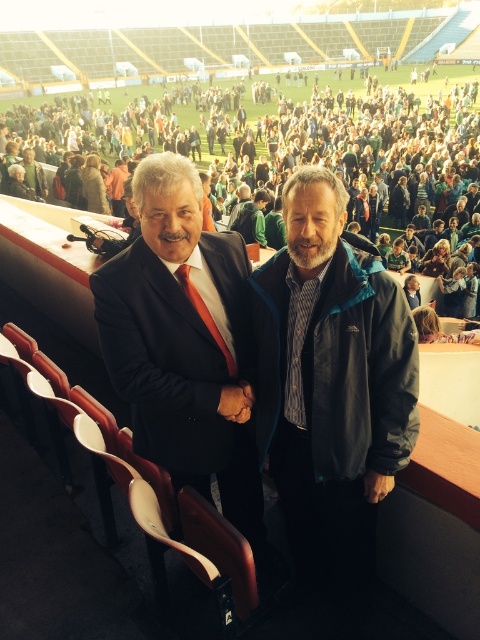
Question: Which object is closer to the camera taking this photo?

Choices:
 (A) green fabric jacket at center
 (B) dark gray jacket at center
 (C) dark blue suit at center

Answer: (C)

Question: Which of the following is the farthest from the observer?

Choices:
 (A) (346, 257)
 (B) (231, 221)

Answer: (B)

Question: Is dark gray jacket at center above dark blue suit at center?

Choices:
 (A) no
 (B) yes

Answer: (A)

Question: Is dark gray jacket at center above dark blue suit at center?

Choices:
 (A) yes
 (B) no

Answer: (B)

Question: Does dark gray jacket at center have a smaller size compared to green fabric jacket at center?

Choices:
 (A) no
 (B) yes

Answer: (B)

Question: Which of the following is the farthest from the observer?

Choices:
 (A) (288, 216)
 (B) (183, 195)

Answer: (A)